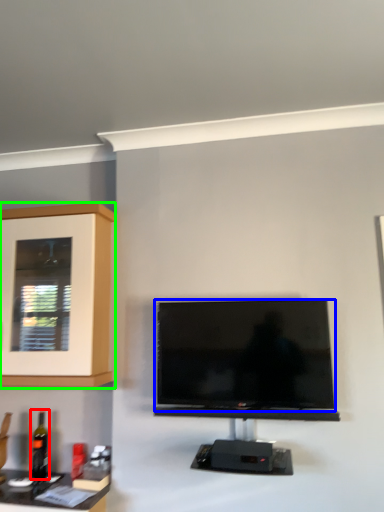
Question: Based on their relative distances, which object is farther from bottle (highlighted by a red box)? Choose from television (highlighted by a blue box) and cabinetry (highlighted by a green box).

Choices:
 (A) television
 (B) cabinetry

Answer: (A)